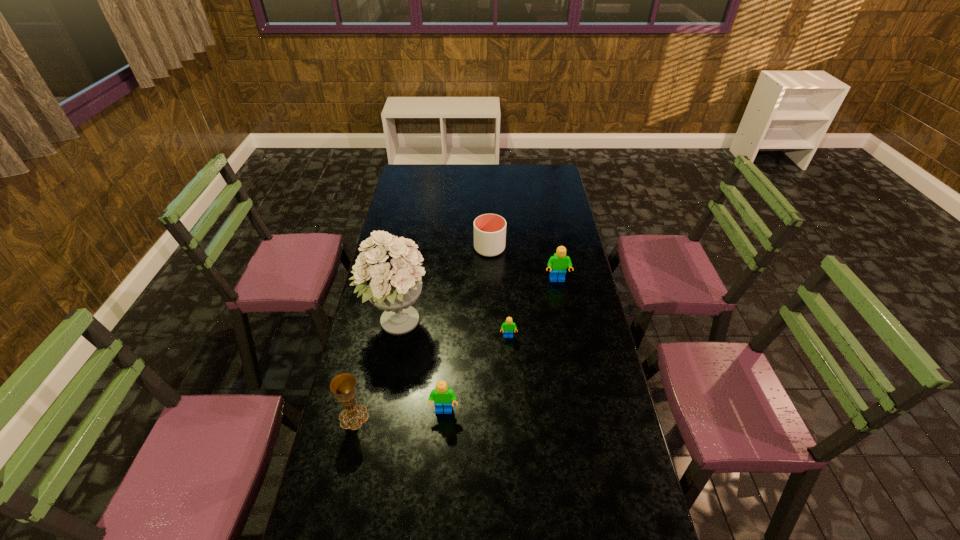
Find the location of a particular element. This screenshot has width=960, height=540. free space at the right edge is located at coordinates (583, 405).

Where is `blank space at the far left corner of the desktop`? blank space at the far left corner of the desktop is located at coordinates (414, 181).

Find the location of a particular element. This screenshot has height=540, width=960. free space between the shortest Lego and the nearest Lego is located at coordinates (476, 374).

Image resolution: width=960 pixels, height=540 pixels. I want to click on free space between the fourth object from right to left and the farthest object, so click(x=467, y=330).

Where is `free spot between the chalice and the second nearest Lego`? free spot between the chalice and the second nearest Lego is located at coordinates (431, 376).

Find the location of a particular element. This screenshot has width=960, height=540. free spot between the cup and the second tallest Lego is located at coordinates (467, 330).

Find the location of `vacant space in between the shortest object and the farthest Lego`. vacant space in between the shortest object and the farthest Lego is located at coordinates (533, 308).

You are a GUI agent. You are given a task and a screenshot of the screen. Output one action in this format:
    pyautogui.click(x=<x>, y=<y>)
    Task: Click on the empty space that is in between the farthest Lego and the chalice
    This screenshot has height=540, width=960.
    Given the screenshot: What is the action you would take?
    pyautogui.click(x=455, y=348)

Image resolution: width=960 pixels, height=540 pixels. I want to click on free space between the fifth nearest object and the cup, so click(x=523, y=264).

You are a GUI agent. You are given a task and a screenshot of the screen. Output one action in this format:
    pyautogui.click(x=<x>, y=<y>)
    Task: Click on the free point between the shortest object and the farthest Lego
    
    Given the screenshot: What is the action you would take?
    pyautogui.click(x=533, y=308)